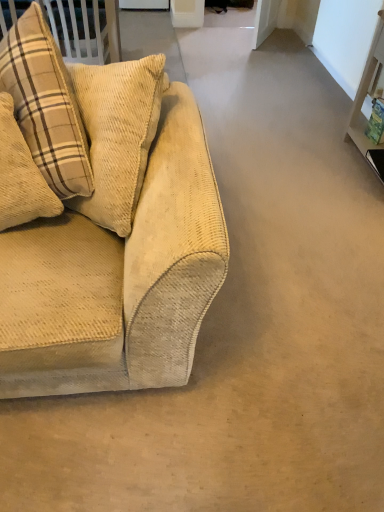
The height and width of the screenshot is (512, 384). I want to click on beige corduroy pillow at left, so click(x=20, y=176).

Describe the element at coordinates (20, 176) in the screenshot. The image size is (384, 512). I see `beige corduroy pillow at left` at that location.

What is the approximate width of beige corduroy couch at left?

beige corduroy couch at left is 16.59 inches wide.

What do you see at coordinates (111, 243) in the screenshot? Image resolution: width=384 pixels, height=512 pixels. I see `beige corduroy couch at left` at bounding box center [111, 243].

Find the location of a particular element. This screenshot has height=512, width=384. beige corduroy couch at left is located at coordinates (111, 243).

This screenshot has height=512, width=384. What are the coordinates of `beige corduroy pillow at left` in the screenshot? It's located at (20, 176).

Would you say beige corduroy couch at left is to the left or to the right of beige corduroy pillow at left in the picture?

Clearly, beige corduroy couch at left is on the right of beige corduroy pillow at left in the image.

Consider the image. Which is behind, beige corduroy couch at left or beige corduroy pillow at left?

beige corduroy pillow at left is behind.

Considering the points (111, 376) and (29, 216), which point is in front, point (111, 376) or point (29, 216)?

The point (111, 376) is closer.

From the image's perspective, is beige corduroy couch at left beneath beige corduroy pillow at left?

Incorrect, from the image's perspective, beige corduroy couch at left is higher than beige corduroy pillow at left.

From a real-world perspective, who is located higher, beige corduroy couch at left or beige corduroy pillow at left?

beige corduroy pillow at left.

Considering the relative sizes of beige corduroy couch at left and beige corduroy pillow at left in the image provided, is beige corduroy couch at left wider than beige corduroy pillow at left?

Indeed, beige corduroy couch at left has a greater width compared to beige corduroy pillow at left.

Looking at this image, considering the sizes of objects beige corduroy couch at left and beige corduroy pillow at left in the image provided, who is shorter, beige corduroy couch at left or beige corduroy pillow at left?

beige corduroy pillow at left.

Considering the sizes of objects beige corduroy couch at left and beige corduroy pillow at left in the image provided, who is bigger, beige corduroy couch at left or beige corduroy pillow at left?

Bigger between the two is beige corduroy couch at left.

Do you think beige corduroy couch at left is within beige corduroy pillow at left, or outside of it?

beige corduroy couch at left lies outside beige corduroy pillow at left.

Is beige corduroy couch at left not near beige corduroy pillow at left?

beige corduroy couch at left is near beige corduroy pillow at left, not far away.

Could you tell me if beige corduroy couch at left is turned towards beige corduroy pillow at left?

Yes, beige corduroy couch at left is aimed at beige corduroy pillow at left.

Can you tell me how much beige corduroy couch at left and beige corduroy pillow at left differ in facing direction?

beige corduroy couch at left and beige corduroy pillow at left are facing 57.2 degrees away from each other.

The width and height of the screenshot is (384, 512). In the image, there is a beige corduroy couch at left. Find the location of `pillow below it (from the image's perspective)`. pillow below it (from the image's perspective) is located at coordinates (20, 176).

Based on their positions, is beige corduroy pillow at left located to the left or right of beige corduroy couch at left?

From the image, it's evident that beige corduroy pillow at left is to the left of beige corduroy couch at left.

Between beige corduroy pillow at left and beige corduroy couch at left, which one is positioned in front?

beige corduroy couch at left is closer to the camera.

Which is closer to the camera, (1, 193) or (144, 165)?

The point (1, 193) is closer.

From the image's perspective, which is below, beige corduroy pillow at left or beige corduroy couch at left?

beige corduroy pillow at left, from the image's perspective.

From a real-world perspective, between beige corduroy pillow at left and beige corduroy couch at left, who is vertically higher?

From a 3D spatial view, beige corduroy pillow at left is above.

Is beige corduroy pillow at left wider than beige corduroy couch at left?

No.

Does beige corduroy pillow at left have a lesser height compared to beige corduroy couch at left?

Yes, beige corduroy pillow at left is shorter than beige corduroy couch at left.

Does beige corduroy pillow at left have a larger size compared to beige corduroy couch at left?

Incorrect, beige corduroy pillow at left is not larger than beige corduroy couch at left.

Can beige corduroy couch at left be found inside beige corduroy pillow at left?

No, beige corduroy pillow at left does not contain beige corduroy couch at left.

Is beige corduroy pillow at left next to beige corduroy couch at left and touching it?

There is a gap between beige corduroy pillow at left and beige corduroy couch at left.

Is beige corduroy couch at left at the back of beige corduroy pillow at left?

Correct, beige corduroy pillow at left is looking away from beige corduroy couch at left.

How far apart are beige corduroy pillow at left and beige corduroy couch at left?

beige corduroy pillow at left and beige corduroy couch at left are 11.21 inches apart from each other.

This screenshot has height=512, width=384. Identify the location of pillow located above the beige corduroy couch at left (from a real-world perspective). (20, 176).

Where is `studio couch in front of the beige corduroy pillow at left`? The image size is (384, 512). studio couch in front of the beige corduroy pillow at left is located at coordinates (111, 243).

Locate an element on the screen. studio couch located underneath the beige corduroy pillow at left (from a real-world perspective) is located at coordinates (111, 243).